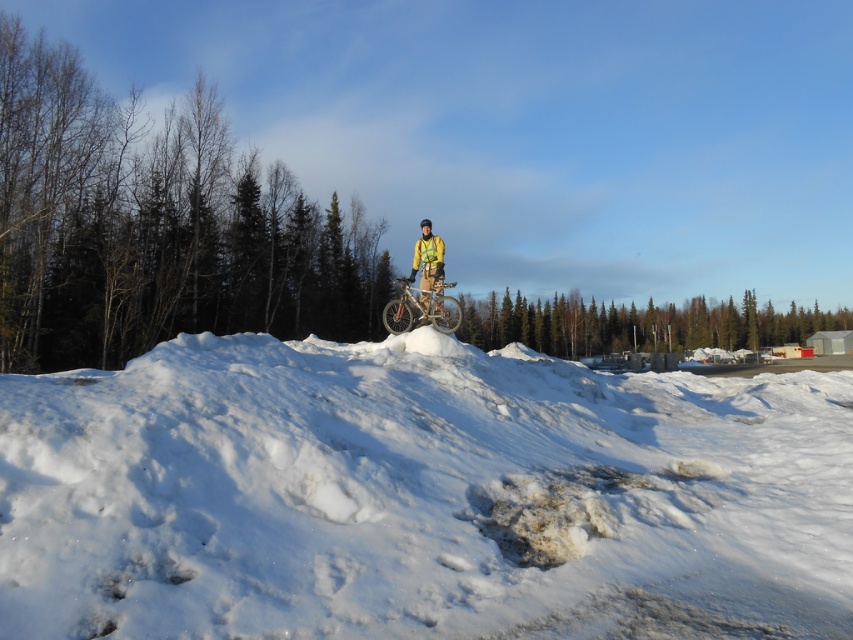
Question: Which of the following is the closest to the observer?

Choices:
 (A) white fluffy snow at center
 (B) silver metallic bicycle at center
 (C) yellow fabric jacket at center

Answer: (A)

Question: Is white fluffy snow at center above silver metallic bicycle at center?

Choices:
 (A) yes
 (B) no

Answer: (B)

Question: Which object is positioned farthest from the yellow fabric jacket at center?

Choices:
 (A) white fluffy snow at center
 (B) silver metallic bicycle at center

Answer: (A)

Question: Which point is closer to the camera taking this photo?

Choices:
 (A) (141, 547)
 (B) (415, 252)

Answer: (A)

Question: Can you confirm if silver metallic bicycle at center is thinner than yellow fabric jacket at center?

Choices:
 (A) yes
 (B) no

Answer: (B)

Question: Is white fluffy snow at center positioned in front of silver metallic bicycle at center?

Choices:
 (A) yes
 (B) no

Answer: (A)